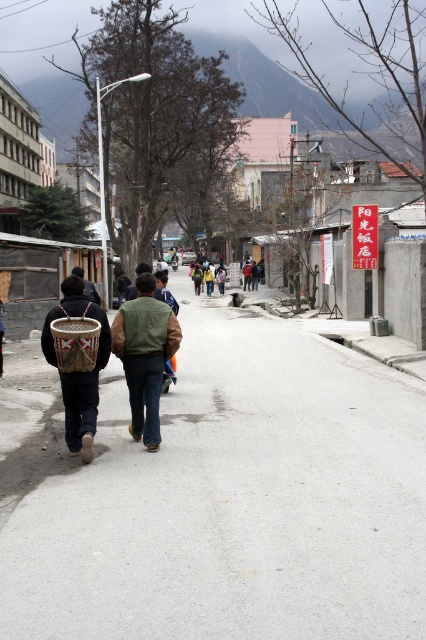
Question: Can you confirm if smooth asphalt road at center is positioned below brown woven basket at left?

Choices:
 (A) no
 (B) yes

Answer: (B)

Question: Which object appears farthest from the camera in this image?

Choices:
 (A) smooth asphalt road at center
 (B) brown woven basket at left
 (C) woven brown basket at rear
 (D) green suede vest at center

Answer: (D)

Question: Which object is closer to the camera taking this photo?

Choices:
 (A) brown woven basket at left
 (B) green suede vest at center
 (C) smooth asphalt road at center
 (D) woven brown basket at rear

Answer: (C)

Question: Is smooth asphalt road at center below brown woven basket at left?

Choices:
 (A) yes
 (B) no

Answer: (A)

Question: Can you confirm if smooth asphalt road at center is positioned below brown woven basket at left?

Choices:
 (A) yes
 (B) no

Answer: (A)

Question: Which of these objects is positioned closest to the brown woven basket at left?

Choices:
 (A) woven brown basket at rear
 (B) green suede vest at center

Answer: (A)